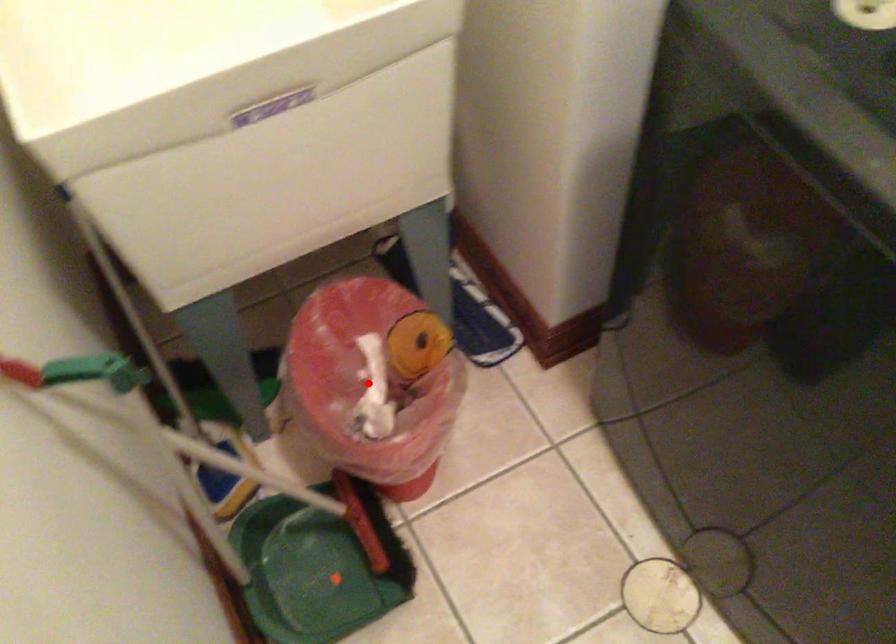
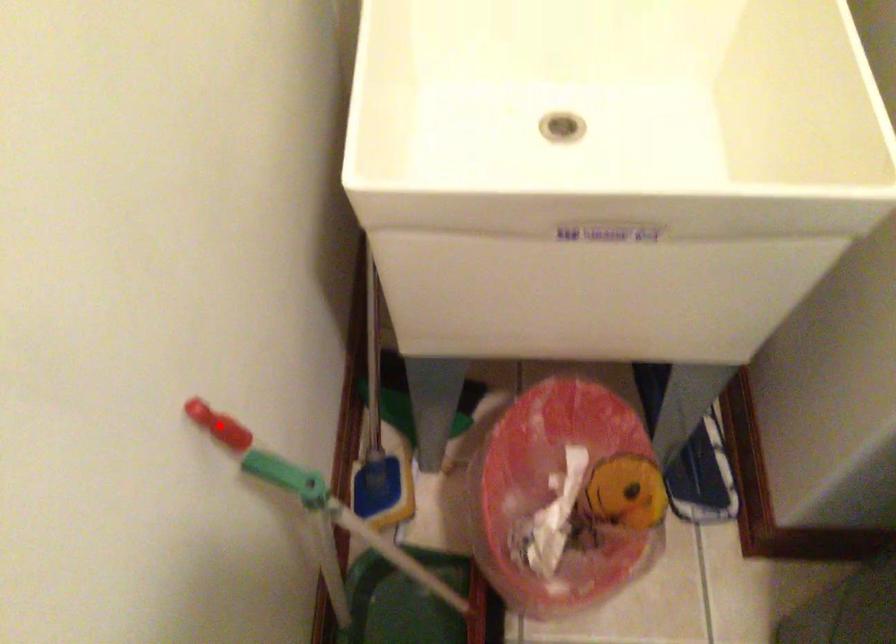
I am providing you with two images of the same scene from different viewpoints. A red point is marked on the first image and another point is marked on the second image. Do the highlighted points in image1 and image2 indicate the same real-world spot?

No